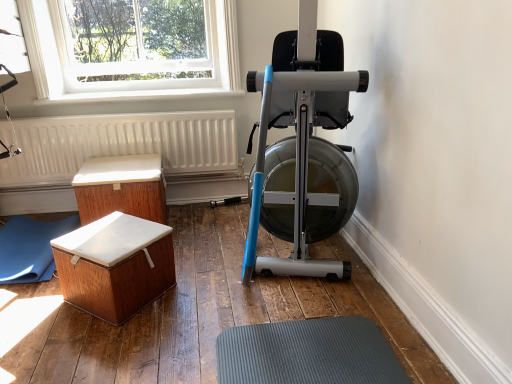
Identify the location of free location to the right of wooden chest at lower left, marked as the 2th furniture in a back-to-front arrangement. (198, 297).